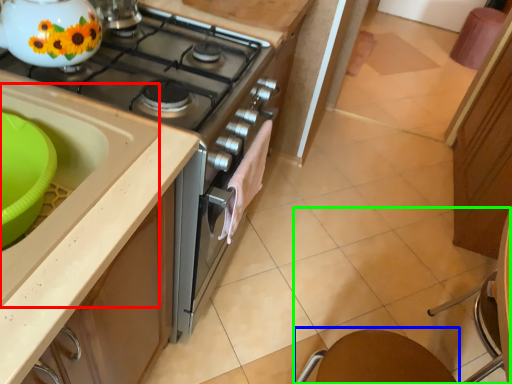
Question: Based on their relative distances, which object is farther from sink (highlighted by a red box)? Choose from round table (highlighted by a blue box) and chair (highlighted by a green box).

Choices:
 (A) round table
 (B) chair

Answer: (B)